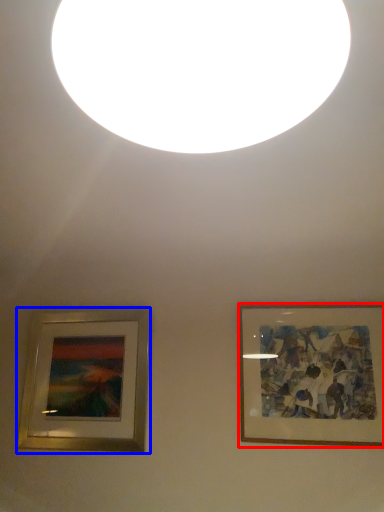
Question: Which of the following is the farthest to the observer, picture frame (highlighted by a red box) or picture frame (highlighted by a blue box)?

Choices:
 (A) picture frame
 (B) picture frame

Answer: (B)